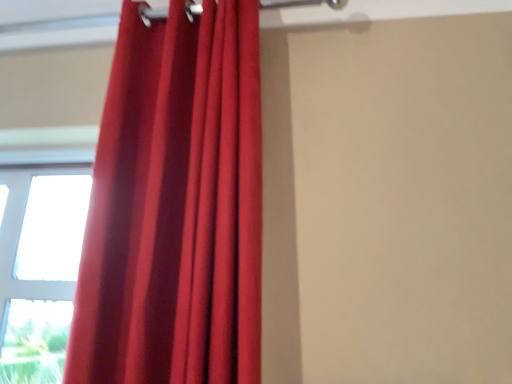
In order to face matte red curtain at left, should I rotate leftwards or rightwards?

To align with it, rotate left about 9.343°.

Measure the distance between point (162, 172) and camera.

A distance of 37.95 inches exists between point (162, 172) and camera.

Describe the element at coordinates (175, 206) in the screenshot. I see `matte red curtain at left` at that location.

I want to click on matte red curtain at left, so click(175, 206).

In order to click on matte red curtain at left in this screenshot , I will do `click(175, 206)`.